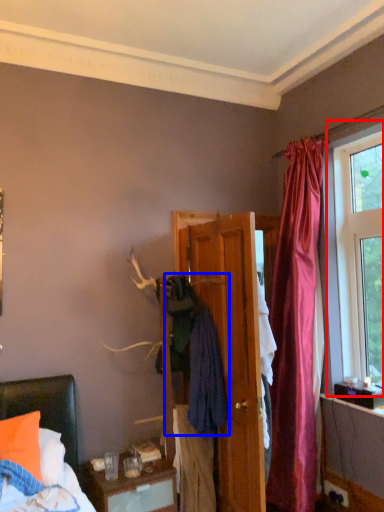
Question: Which object appears farthest to the camera in this image, window (highlighted by a red box) or clothing (highlighted by a blue box)?

Choices:
 (A) window
 (B) clothing

Answer: (A)